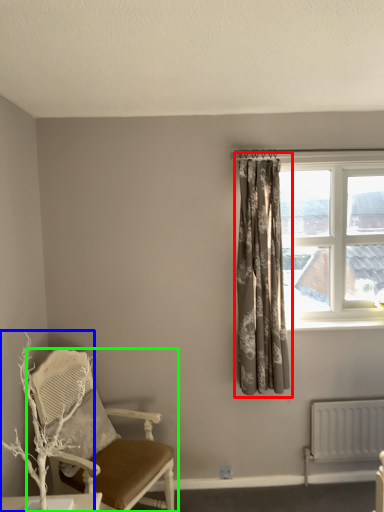
Question: Considering the real-world distances, which object is farthest from curtain (highlighted by a red box)? branch (highlighted by a blue box) or chair (highlighted by a green box)?

Choices:
 (A) branch
 (B) chair

Answer: (A)